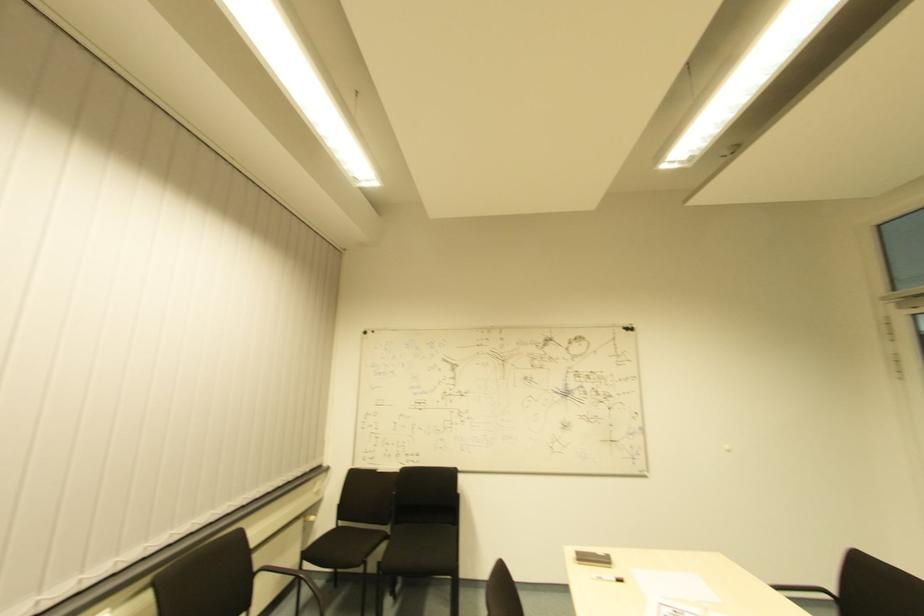
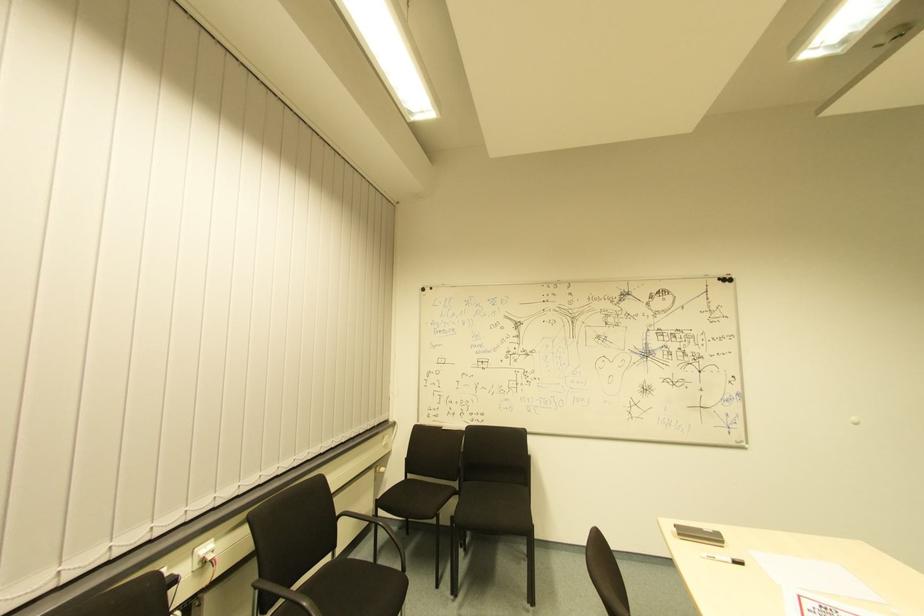
Question: The camera is either moving clockwise (left) or counter-clockwise (right) around the object. The first image is from the beginning of the video and the second image is from the end. Is the camera moving left or right when shooting the video?

Choices:
 (A) Left
 (B) Right

Answer: (B)